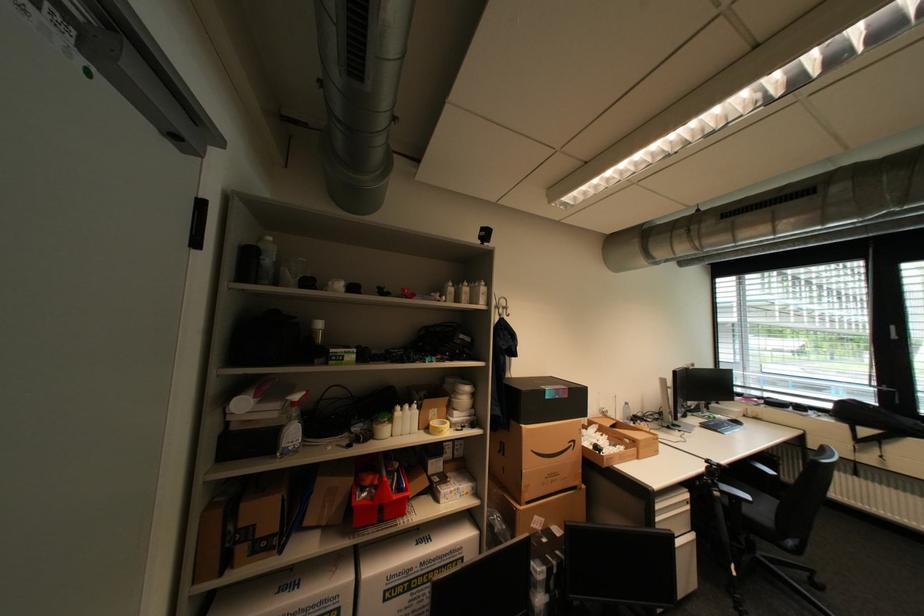
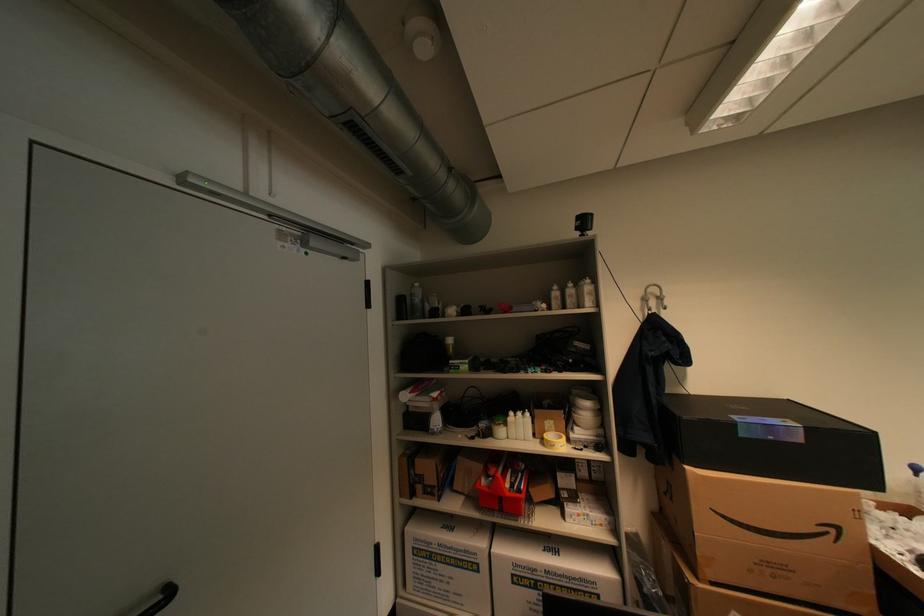
Locate, in the second image, the point that corresponds to (x=457, y=408) in the first image.

(578, 422)